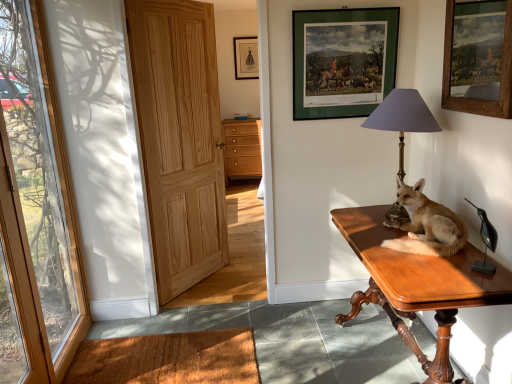
Question: Is brown fur stuffed fox at right positioned in front of brown coir mat at lower left?

Choices:
 (A) no
 (B) yes

Answer: (B)

Question: Is brown fur stuffed fox at right thinner than brown coir mat at lower left?

Choices:
 (A) no
 (B) yes

Answer: (B)

Question: Would you say brown fur stuffed fox at right contains brown coir mat at lower left?

Choices:
 (A) no
 (B) yes

Answer: (A)

Question: Does brown fur stuffed fox at right have a larger size compared to brown coir mat at lower left?

Choices:
 (A) yes
 (B) no

Answer: (A)

Question: From a real-world perspective, is brown fur stuffed fox at right located beneath brown coir mat at lower left?

Choices:
 (A) no
 (B) yes

Answer: (A)

Question: Is brown fur stuffed fox at right behind brown coir mat at lower left?

Choices:
 (A) yes
 (B) no

Answer: (B)

Question: Does matte wood cabinet at center come in front of natural wood door at left, the 1th door when ordered from right to left?

Choices:
 (A) no
 (B) yes

Answer: (A)

Question: Is matte wood cabinet at center aimed at natural wood door at left, the second door when ordered from left to right?

Choices:
 (A) yes
 (B) no

Answer: (A)

Question: Is matte wood cabinet at center not inside natural wood door at left, the 1th door when ordered from right to left?

Choices:
 (A) no
 (B) yes

Answer: (B)

Question: From the image's perspective, does matte wood cabinet at center appear higher than natural wood door at left, the second door when ordered from left to right?

Choices:
 (A) no
 (B) yes

Answer: (B)

Question: From a real-world perspective, does matte wood cabinet at center sit lower than natural wood door at left, the second door when ordered from left to right?

Choices:
 (A) yes
 (B) no

Answer: (A)

Question: Is matte wood cabinet at center looking in the opposite direction of natural wood door at left, the second door when ordered from left to right?

Choices:
 (A) yes
 (B) no

Answer: (B)

Question: Would you say black glossy bird at right contains green matte picture frame at upper center, which is the second picture frame in left-to-right order?

Choices:
 (A) yes
 (B) no

Answer: (B)